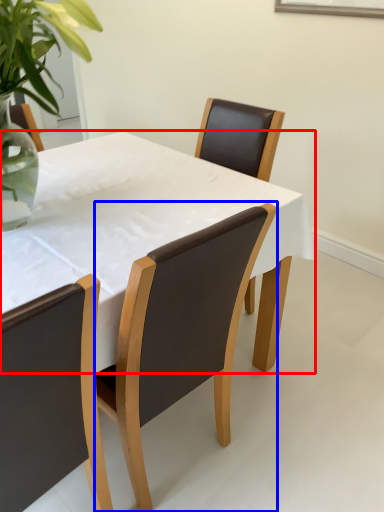
Question: Which object is further to the camera taking this photo, kitchen & dining room table (highlighted by a red box) or chair (highlighted by a blue box)?

Choices:
 (A) kitchen & dining room table
 (B) chair

Answer: (B)